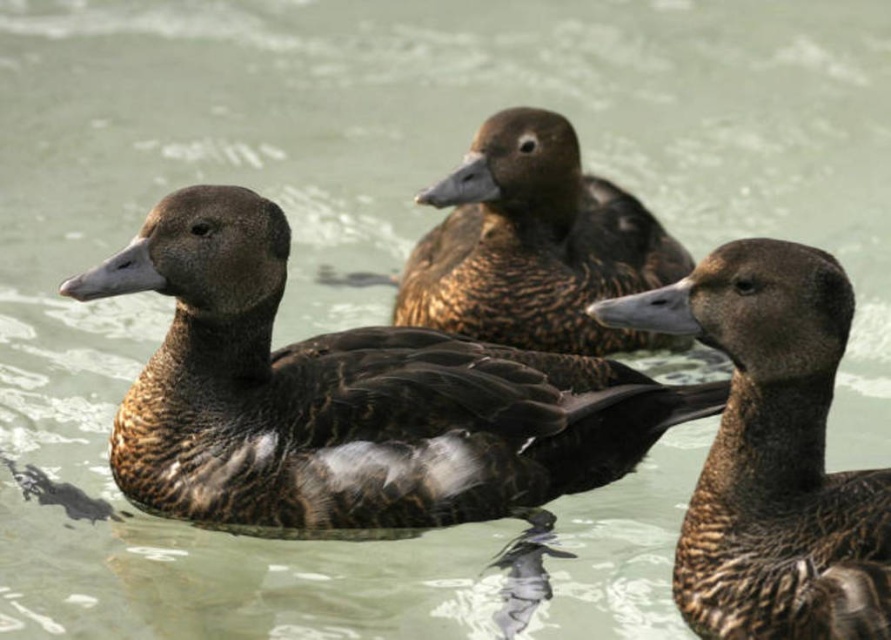
Question: Does brown matte duck at center appear under brown speckled feathers at center?

Choices:
 (A) no
 (B) yes

Answer: (B)

Question: Among these points, which one is farthest from the camera?

Choices:
 (A) (824, 544)
 (B) (560, 268)
 (C) (242, 358)

Answer: (B)

Question: Can you confirm if brown matte duck at center is wider than brown speckled duck at center?

Choices:
 (A) yes
 (B) no

Answer: (A)

Question: Which object is positioned closest to the brown matte duck at center?

Choices:
 (A) brown speckled feathers at center
 (B) brown speckled duck at center

Answer: (B)

Question: Can you confirm if brown speckled duck at center is wider than brown speckled feathers at center?

Choices:
 (A) yes
 (B) no

Answer: (B)

Question: Which point appears closest to the camera in this image?

Choices:
 (A) (683, 605)
 (B) (628, 278)

Answer: (A)